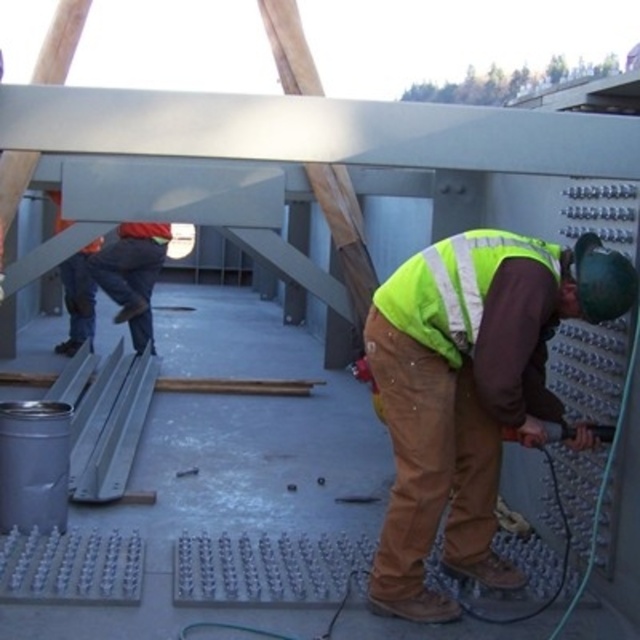
You are a safety inspector checking the visibility of safety gear at a construction site. You notice two vests in the image. Which vest, the high visibility yellow safety vest at lower right or the orange reflective vest at upper left, has a larger width?

The high visibility yellow safety vest at lower right might be wider than orange reflective vest at upper left according to the description.

You are a safety inspector at the construction site. You need to check if the distance between the high visibility yellow safety vest at lower right and the camera is within the recommended 8 feet safety zone. Is the distance compliant?

The distance between the high visibility yellow safety vest at lower right and the camera is 8.25 feet, which exceeds the recommended 8 feet safety zone. Therefore, it is not compliant.

You are a safety inspector at the construction site. You need to locate the high visibility yellow safety vest at lower right. What are its coordinates?

The high visibility yellow safety vest at lower right is located at coordinates point (468, 388).